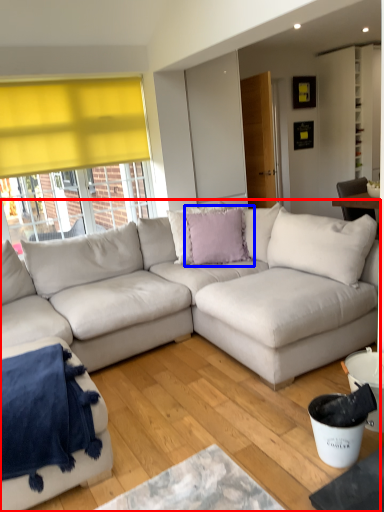
Question: Which of the following is the closest to the observer, studio couch (highlighted by a red box) or pillow (highlighted by a blue box)?

Choices:
 (A) studio couch
 (B) pillow

Answer: (A)